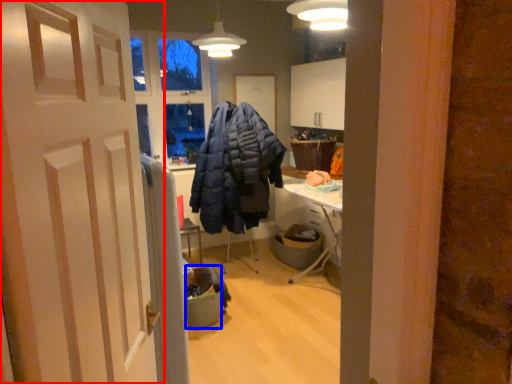
Question: Which object appears farthest to the camera in this image, door (highlighted by a red box) or trash bin/can (highlighted by a blue box)?

Choices:
 (A) door
 (B) trash bin/can

Answer: (B)